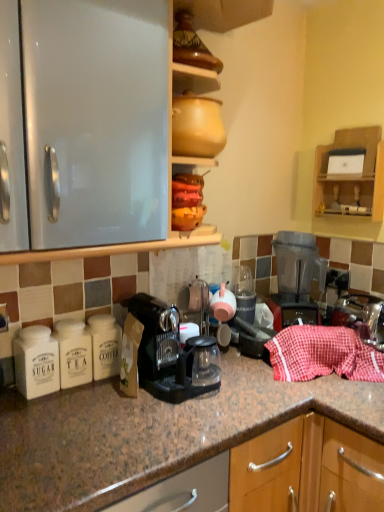
Question: Could black plastic coffee machine at center be considered to be inside wooden shelf at upper right?

Choices:
 (A) no
 (B) yes

Answer: (A)

Question: Does wooden shelf at upper right have a lesser height compared to black plastic coffee machine at center?

Choices:
 (A) yes
 (B) no

Answer: (B)

Question: From the image's perspective, does wooden shelf at upper right appear higher than black plastic coffee machine at center?

Choices:
 (A) yes
 (B) no

Answer: (A)

Question: Is wooden shelf at upper right positioned behind black plastic coffee machine at center?

Choices:
 (A) yes
 (B) no

Answer: (A)

Question: Is wooden shelf at upper right wider than black plastic coffee machine at center?

Choices:
 (A) no
 (B) yes

Answer: (A)

Question: Is wooden shelf at upper right aimed at black plastic coffee machine at center?

Choices:
 (A) yes
 (B) no

Answer: (A)

Question: Is red checkered cloth at right placed right next to matte glass tea pot at center?

Choices:
 (A) no
 (B) yes

Answer: (A)

Question: Considering the relative sizes of red checkered cloth at right and matte glass tea pot at center in the image provided, is red checkered cloth at right thinner than matte glass tea pot at center?

Choices:
 (A) yes
 (B) no

Answer: (B)

Question: Can you confirm if red checkered cloth at right is smaller than matte glass tea pot at center?

Choices:
 (A) yes
 (B) no

Answer: (B)

Question: Is red checkered cloth at right shorter than matte glass tea pot at center?

Choices:
 (A) no
 (B) yes

Answer: (A)

Question: Considering the relative positions of red checkered cloth at right and matte glass tea pot at center in the image provided, is red checkered cloth at right behind matte glass tea pot at center?

Choices:
 (A) no
 (B) yes

Answer: (A)

Question: Is red checkered cloth at right taller than matte glass tea pot at center?

Choices:
 (A) no
 (B) yes

Answer: (B)

Question: Would you say wooden shelf at upper right contains red checkered cloth at right?

Choices:
 (A) yes
 (B) no

Answer: (B)